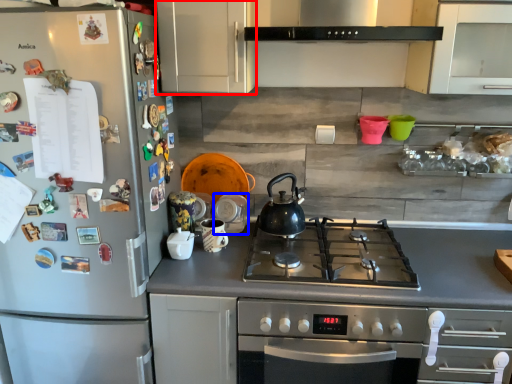
Question: Which of the following is the farthest to the observer, cabinetry (highlighted by a red box) or appliance (highlighted by a blue box)?

Choices:
 (A) cabinetry
 (B) appliance

Answer: (B)